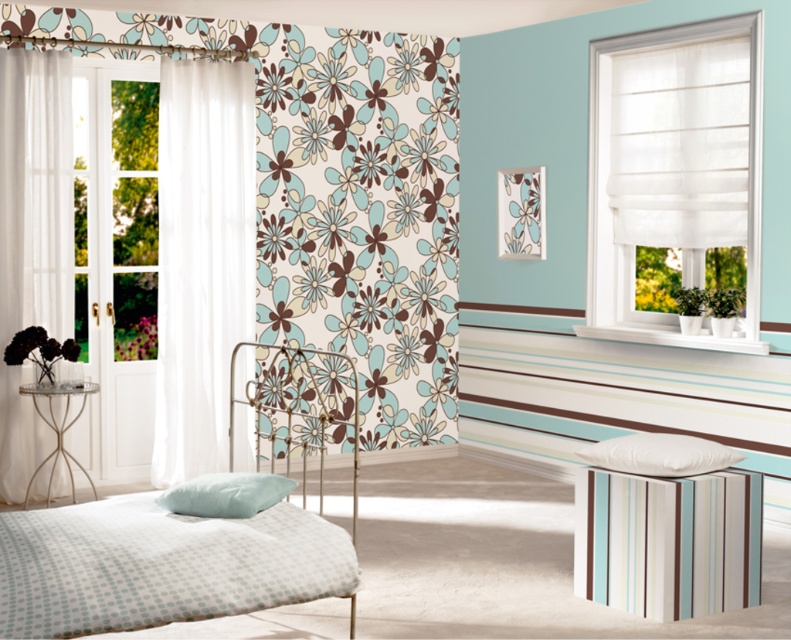
Can you confirm if sheer white curtain at left is positioned below satin soft pillow at lower left?

Incorrect, sheer white curtain at left is not positioned below satin soft pillow at lower left.

Does sheer white curtain at left appear on the right side of satin soft pillow at lower left?

In fact, sheer white curtain at left is to the left of satin soft pillow at lower left.

The width and height of the screenshot is (791, 640). What do you see at coordinates (32, 237) in the screenshot?
I see `sheer white curtain at left` at bounding box center [32, 237].

Identify the location of sheer white curtain at left. (32, 237).

Can you confirm if sheer white curtain at left is positioned to the right of striped fabric stool at lower right?

Incorrect, sheer white curtain at left is not on the right side of striped fabric stool at lower right.

Between sheer white curtain at left and striped fabric stool at lower right, which one is positioned lower?

striped fabric stool at lower right

This screenshot has width=791, height=640. Describe the element at coordinates (32, 237) in the screenshot. I see `sheer white curtain at left` at that location.

This screenshot has height=640, width=791. Find the location of `sheer white curtain at left`. sheer white curtain at left is located at coordinates (32, 237).

Is point (292, 404) farther from viewer compared to point (649, 550)?

That is True.

Between white dotted fabric bed at left and striped fabric stool at lower right, which one appears on the right side from the viewer's perspective?

striped fabric stool at lower right is more to the right.

The height and width of the screenshot is (640, 791). What are the coordinates of `white dotted fabric bed at left` in the screenshot? It's located at (187, 534).